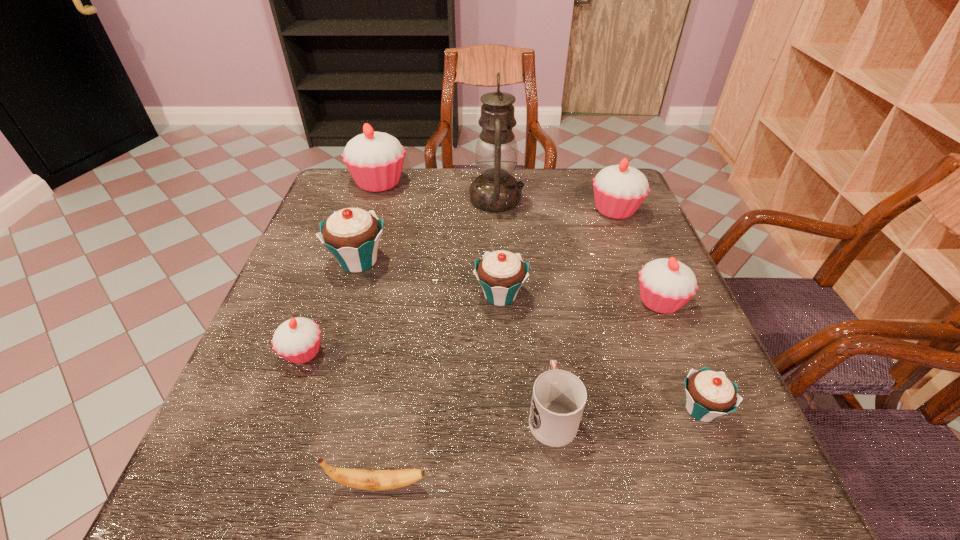
In order to click on the tallest object in this screenshot , I will do `click(496, 153)`.

The width and height of the screenshot is (960, 540). In order to click on the ninth shortest object in this screenshot , I will do `click(375, 160)`.

This screenshot has height=540, width=960. I want to click on the biggest pink cupcake, so click(375, 160).

Locate an element on the screen. The width and height of the screenshot is (960, 540). the second biggest pink cupcake is located at coordinates (619, 190).

Where is `the biggest teal cupcake`? Image resolution: width=960 pixels, height=540 pixels. the biggest teal cupcake is located at coordinates (352, 235).

Locate an element on the screen. Image resolution: width=960 pixels, height=540 pixels. the third farthest pink cupcake is located at coordinates (666, 285).

You are a GUI agent. You are given a task and a screenshot of the screen. Output one action in this format:
    pyautogui.click(x=<x>, y=<y>)
    Task: Click on the second biggest teal cupcake
    
    Given the screenshot: What is the action you would take?
    pyautogui.click(x=501, y=273)

This screenshot has height=540, width=960. I want to click on the fourth cupcake from left to right, so click(501, 273).

Identify the location of red cup. The height and width of the screenshot is (540, 960). (558, 399).

Identify the location of the seventh farthest object. (297, 340).